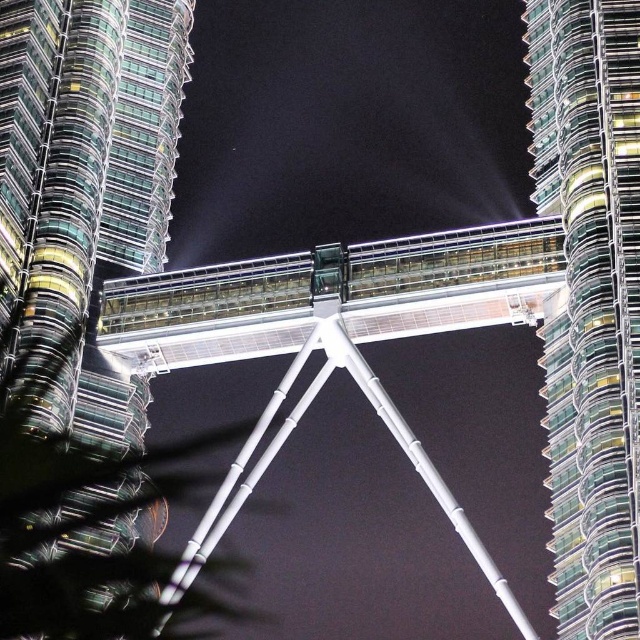
You are standing in front of the Petronas Twin Towers at night. You see the glassy steel skyscraper at center and the white metallic suspension bridge at center. Which object is closer to you?

The glassy steel skyscraper at center is closer to the viewer than the white metallic suspension bridge at center.

You are a drone operator planning to fly a drone between the glassy steel skyscraper at center and the white metallic suspension bridge at center. Given that the drone has a wingspan of 0.5 meters, can it safely pass through the narrowest point between them?

The glassy steel skyscraper at center has a lesser width compared to the white metallic suspension bridge at center, so the narrowest point between them would be determined by the width of the skyscraper. Since the skyscraper is narrower, the gap between them might be sufficient for the drone with a 0.5m wingspan to pass safely.

You are a drone operator planning to fly a drone between the transparent glass tower at center and the white metallic suspension bridge at center. Based on the scene description, which object is smaller in size and would require more precise navigation around it?

The transparent glass tower at center has a smaller size compared to the white metallic suspension bridge at center, so you need to navigate more precisely around the transparent glass tower at center.